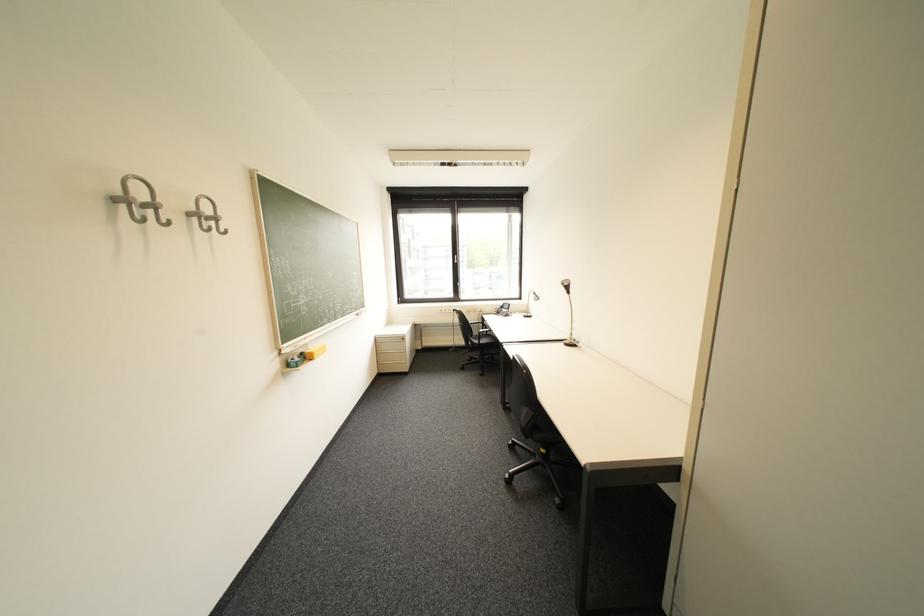
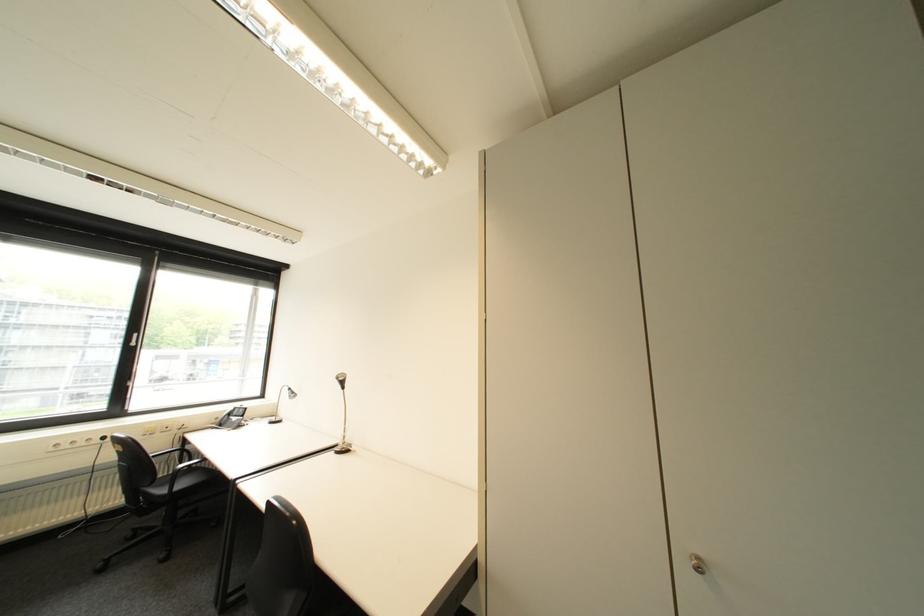
Locate, in the second image, the point that corresponds to (x=492, y=342) in the first image.

(187, 488)